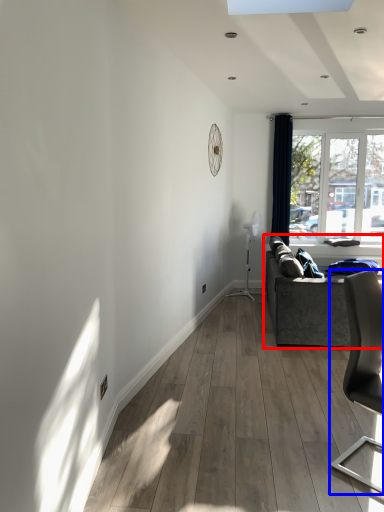
Question: Which of the following is the farthest to the observer, studio couch (highlighted by a red box) or chair (highlighted by a blue box)?

Choices:
 (A) studio couch
 (B) chair

Answer: (A)